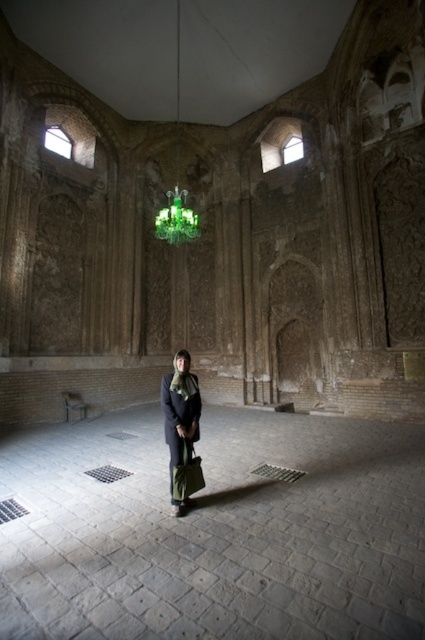
Does dark gray fabric scarf at center have a larger size compared to green glass chandelier at upper center?

Actually, dark gray fabric scarf at center might be smaller than green glass chandelier at upper center.

Find the location of a particular element. dark gray fabric scarf at center is located at coordinates (180, 417).

Does green glass chandelier at upper center appear under green fabric bag at center?

No, green glass chandelier at upper center is not below green fabric bag at center.

Is point (159, 214) positioned behind point (200, 461)?

Yes, point (159, 214) is farther from viewer.

You are a GUI agent. You are given a task and a screenshot of the screen. Output one action in this format:
    pyautogui.click(x=<x>, y=<y>)
    Task: Click on the green glass chandelier at upper center
    This screenshot has width=425, height=640.
    Given the screenshot: What is the action you would take?
    point(176,218)

Can you confirm if dark gray fabric scarf at center is shorter than green fabric bag at center?

In fact, dark gray fabric scarf at center may be taller than green fabric bag at center.

Is point (198, 426) positioned behind point (195, 468)?

That is True.

At what (x,y) coordinates should I click in order to perform the action: click on dark gray fabric scarf at center. Please return your answer as a coordinate pair (x, y). The height and width of the screenshot is (640, 425). Looking at the image, I should click on [180, 417].